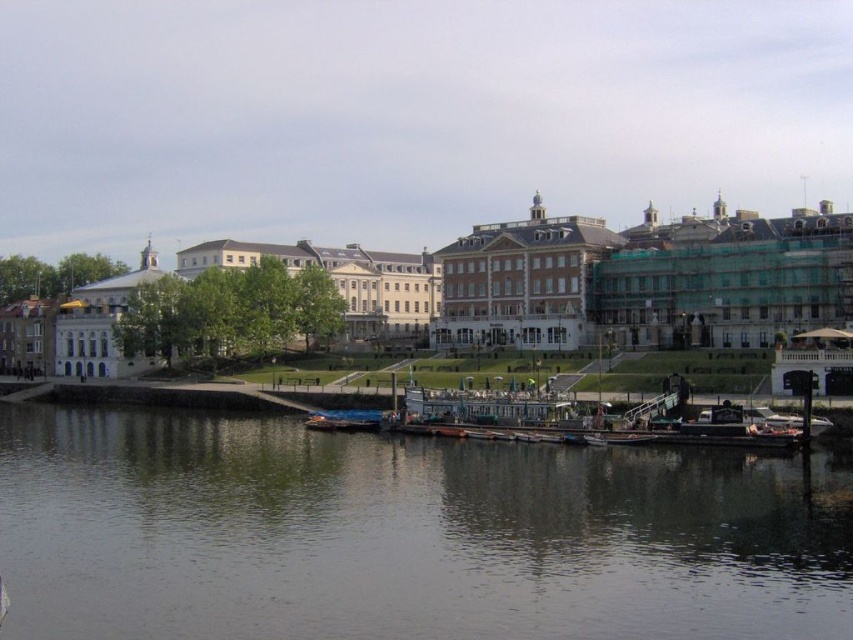
You are a tour guide leading a group along the riverside walkway. You notice the dark gray water at lower center and the blue metallic boat at lower center. A tourist asks if they can walk from the water to the boat in 20 seconds. Assuming a normal walking speed of 1.4 meters per second, is this possible?

The distance between the dark gray water at lower center and the blue metallic boat at lower center is 18.91 meters. At a normal walking speed of 1.4 meters per second, it would take approximately 13.5 seconds to cover this distance. Therefore, yes, the tourist can walk from the dark gray water at lower center to the blue metallic boat at lower center in under 20 seconds.